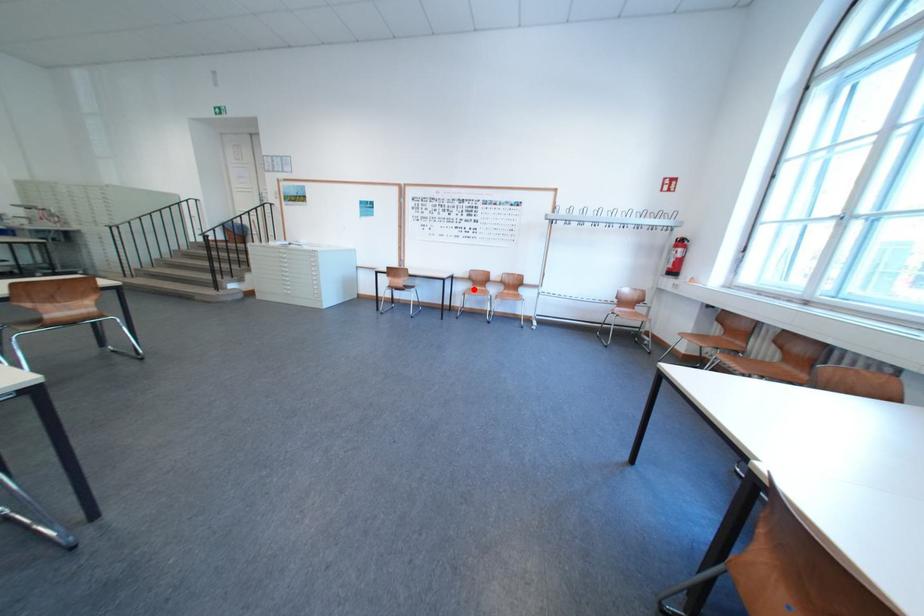
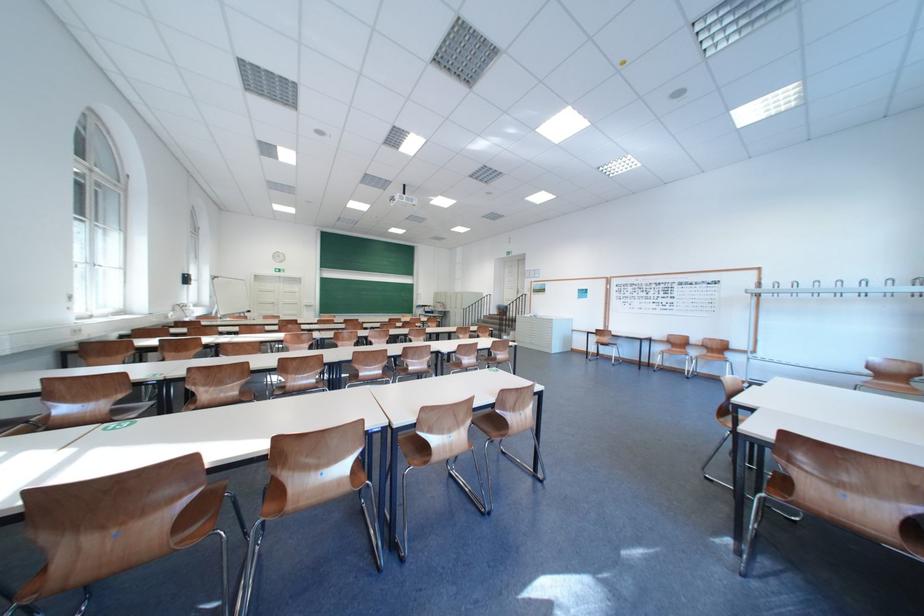
Question: I am providing you with two images of the same scene from different viewpoints. Given a red point in image1, look at the same physical point in image2. Is it:

Choices:
 (A) Closer to the viewpoint
 (B) Farther from the viewpoint

Answer: (B)